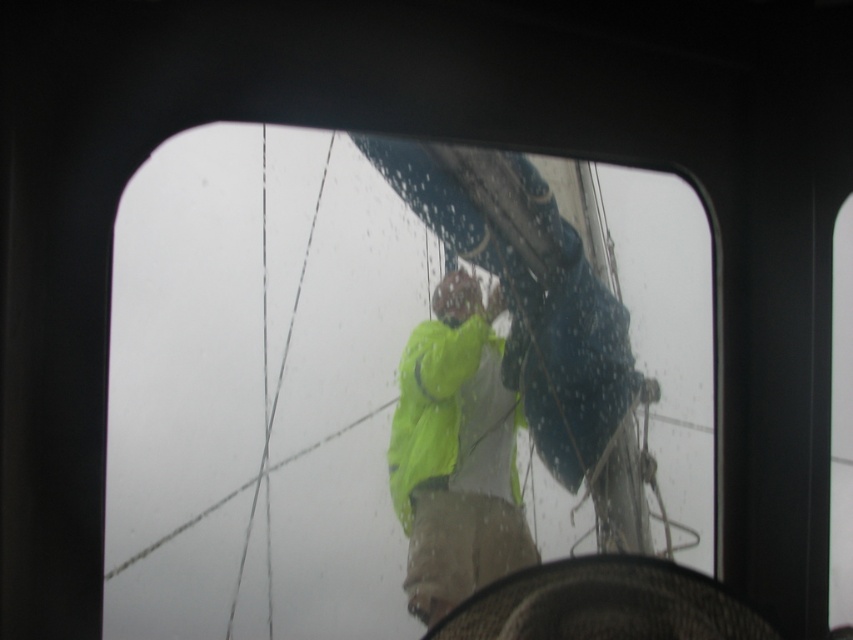
Between transparent glass sailboat at center and neon yellow raincoat at center, which one is positioned higher?

Positioned higher is transparent glass sailboat at center.

Can you confirm if transparent glass sailboat at center is thinner than neon yellow raincoat at center?

No, transparent glass sailboat at center is not thinner than neon yellow raincoat at center.

Is point (498, 317) closer to viewer compared to point (418, 419)?

That is True.

The width and height of the screenshot is (853, 640). I want to click on transparent glass sailboat at center, so click(x=381, y=380).